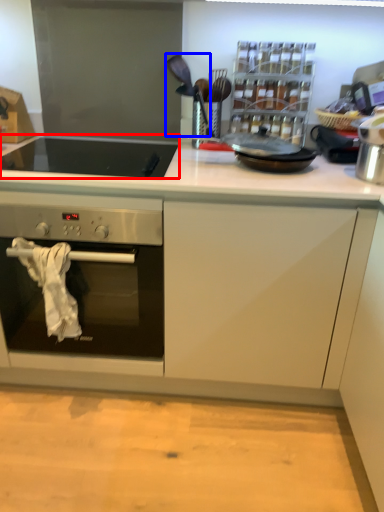
Question: Which object appears farthest to the camera in this image, gas stove (highlighted by a red box) or appliance (highlighted by a blue box)?

Choices:
 (A) gas stove
 (B) appliance

Answer: (B)